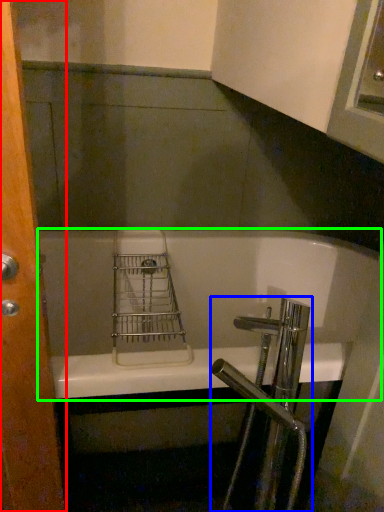
Question: Based on their relative distances, which object is nearer to screen door (highlighted by a red box)? Choose from tap (highlighted by a blue box) and bathtub (highlighted by a green box).

Choices:
 (A) tap
 (B) bathtub

Answer: (A)